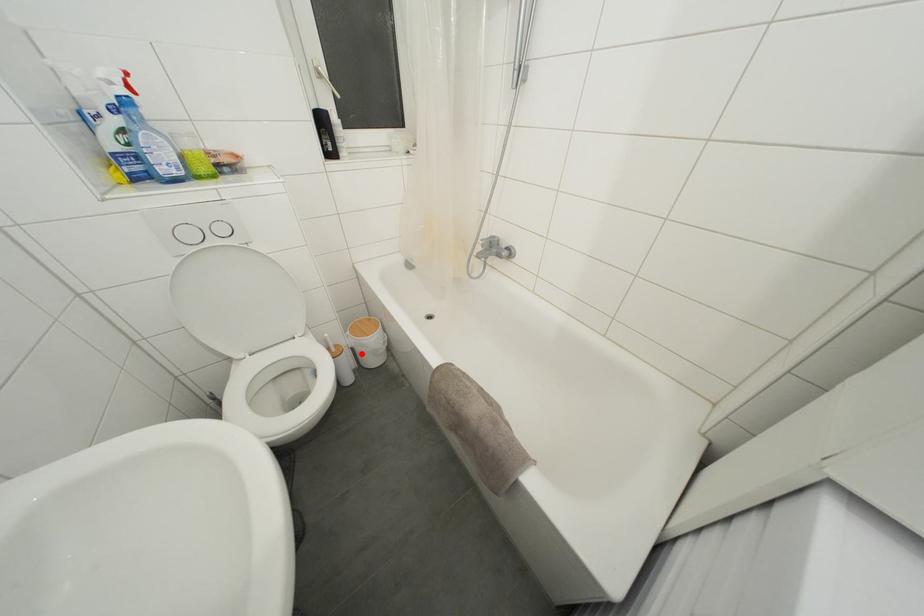
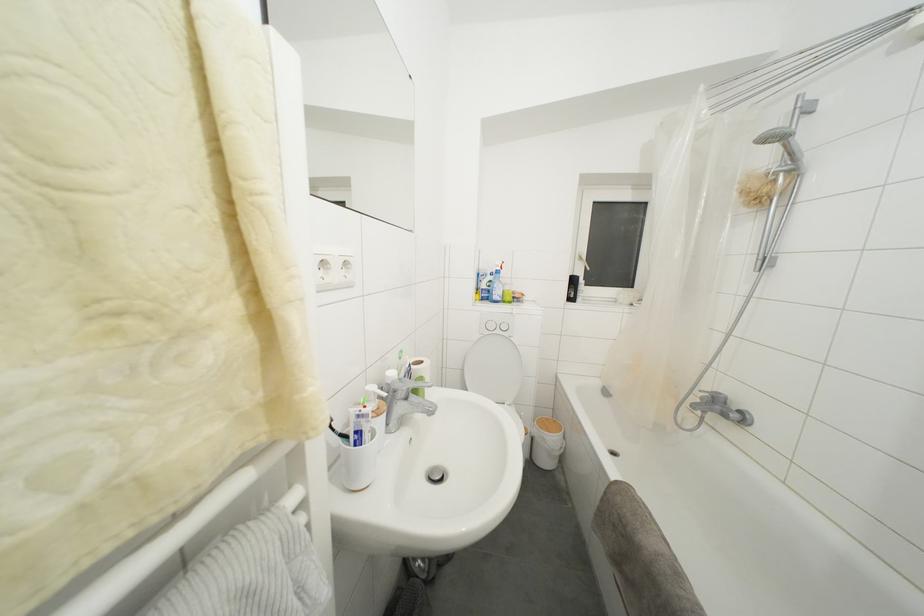
Question: I am providing you with two images of the same scene from different viewpoints. Image1 has a red point marked. In image2, the corresponding 3D location appears at what relative position? Reply with the corresponding letter.

Choices:
 (A) Closer
 (B) Farther

Answer: (B)